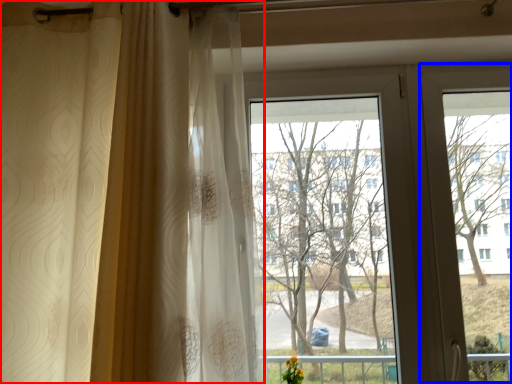
Question: Which of the following is the closest to the observer, curtain (highlighted by a red box) or screen door (highlighted by a blue box)?

Choices:
 (A) curtain
 (B) screen door

Answer: (A)